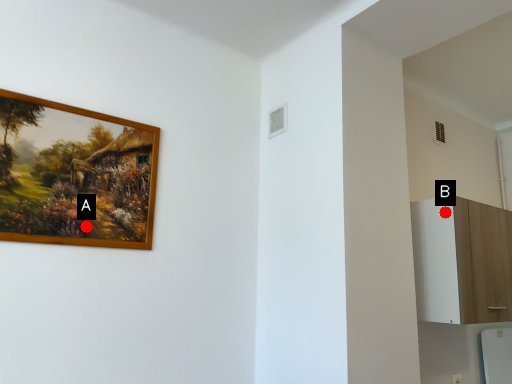
Question: Two points are circled on the image, labeled by A and B beside each circle. Which of the following is the farthest from the observer?

Choices:
 (A) A is further
 (B) B is further

Answer: (B)